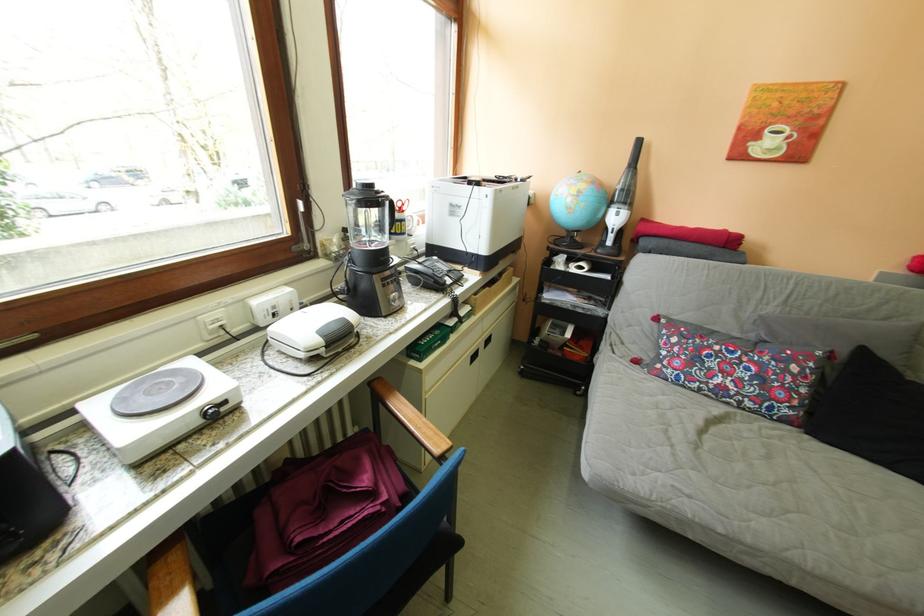
This screenshot has height=616, width=924. Identify the location of blue world globe. (577, 206).